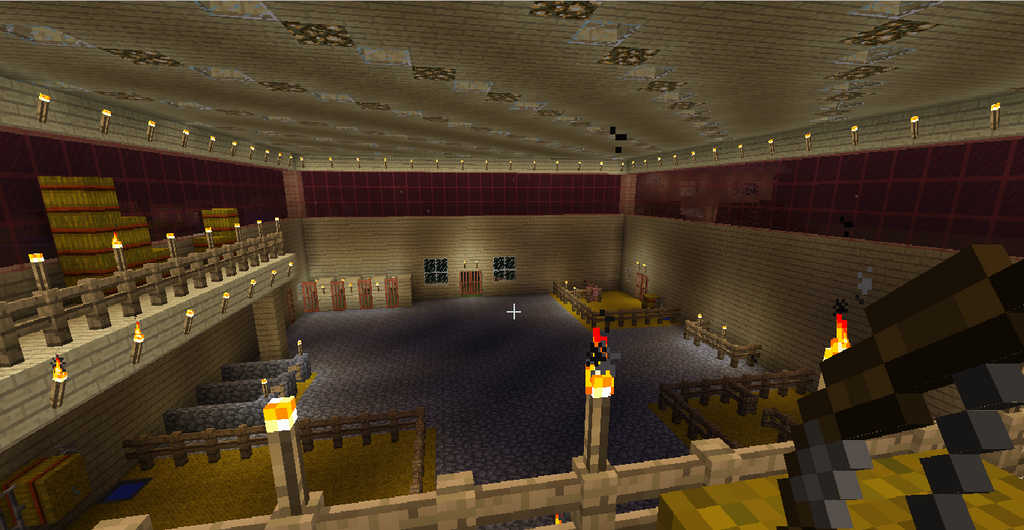
Locate an element on the screen. The width and height of the screenshot is (1024, 530). ceiling is located at coordinates (569, 83).